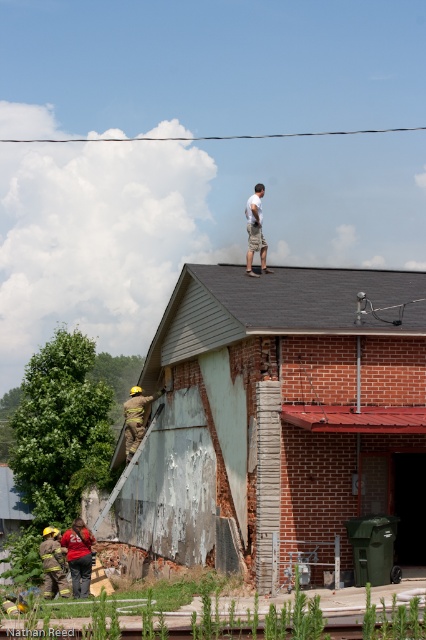
Question: Among these points, which one is nearest to the camera?

Choices:
 (A) (342, 272)
 (B) (173, 349)
 (C) (52, 588)

Answer: (C)

Question: Does peeling paint wall at lower left appear over white cotton shirt at upper center?

Choices:
 (A) yes
 (B) no

Answer: (B)

Question: Which point appears farthest from the camera in this image?

Choices:
 (A) (255, 250)
 (B) (46, 577)
 (C) (213, 294)

Answer: (B)

Question: Where is peeling paint wall at lower left located in relation to gray shingles at upper center in the image?

Choices:
 (A) right
 (B) left

Answer: (B)

Question: Which of the following is the farthest from the observer?

Choices:
 (A) (255, 234)
 (B) (342, 355)

Answer: (A)

Question: Does peeling paint wall at lower left appear over white cotton shirt at upper center?

Choices:
 (A) no
 (B) yes

Answer: (A)